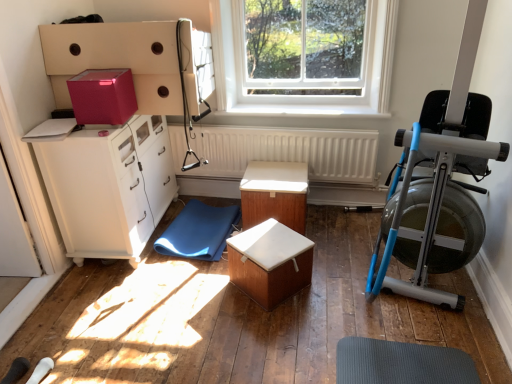
Question: From the image's perspective, is blue rubber yoga mat at lower center over wooden box at center, the first table viewed from the front?

Choices:
 (A) yes
 (B) no

Answer: (A)

Question: Can you confirm if blue rubber yoga mat at lower center is shorter than wooden box at center, the first table viewed from the front?

Choices:
 (A) no
 (B) yes

Answer: (B)

Question: Considering the relative positions of blue rubber yoga mat at lower center and wooden box at center, marked as the second table in a back-to-front arrangement, in the image provided, is blue rubber yoga mat at lower center to the right of wooden box at center, marked as the second table in a back-to-front arrangement, from the viewer's perspective?

Choices:
 (A) no
 (B) yes

Answer: (A)

Question: Is blue rubber yoga mat at lower center positioned before wooden box at center, marked as the second table in a back-to-front arrangement?

Choices:
 (A) yes
 (B) no

Answer: (B)

Question: From a real-world perspective, is blue rubber yoga mat at lower center under wooden box at center, the first table viewed from the front?

Choices:
 (A) no
 (B) yes

Answer: (B)

Question: Is blue rubber yoga mat at lower center aimed at wooden box at center, marked as the second table in a back-to-front arrangement?

Choices:
 (A) no
 (B) yes

Answer: (A)

Question: Can you confirm if wooden table at center, arranged as the 1th table when viewed from the back, is thinner than white matte radiator at center?

Choices:
 (A) yes
 (B) no

Answer: (B)

Question: Does wooden table at center, placed as the second table when sorted from front to back, appear on the right side of white matte radiator at center?

Choices:
 (A) yes
 (B) no

Answer: (B)

Question: Is wooden table at center, placed as the second table when sorted from front to back, positioned with its back to white matte radiator at center?

Choices:
 (A) yes
 (B) no

Answer: (A)

Question: From a real-world perspective, is wooden table at center, arranged as the 1th table when viewed from the back, positioned over white matte radiator at center based on gravity?

Choices:
 (A) yes
 (B) no

Answer: (B)

Question: Does wooden table at center, arranged as the 1th table when viewed from the back, have a greater width compared to white matte radiator at center?

Choices:
 (A) yes
 (B) no

Answer: (A)

Question: Are wooden table at center, placed as the second table when sorted from front to back, and white matte radiator at center beside each other?

Choices:
 (A) no
 (B) yes

Answer: (A)

Question: Can you confirm if blue metallic rowing machine at right is taller than transparent glass window at upper center?

Choices:
 (A) yes
 (B) no

Answer: (A)